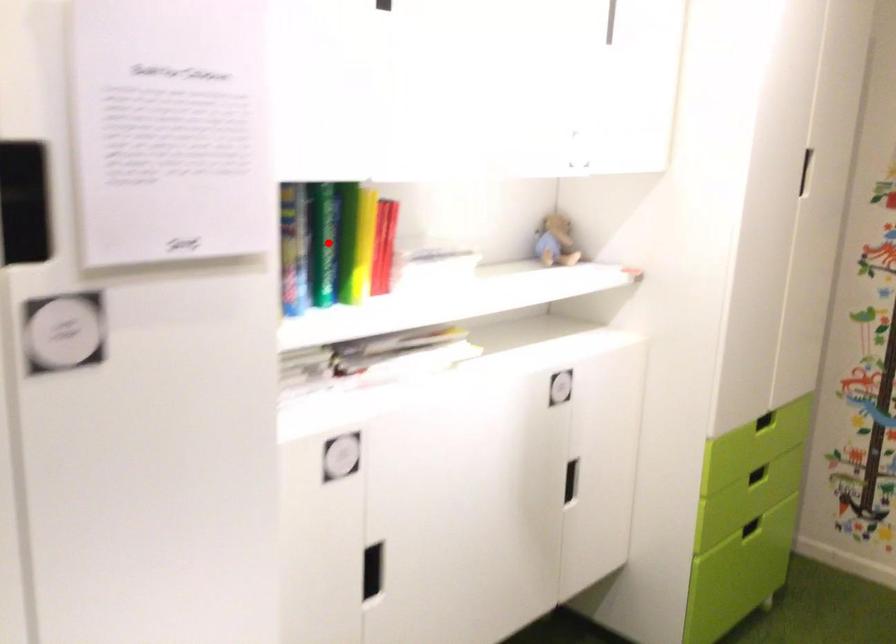
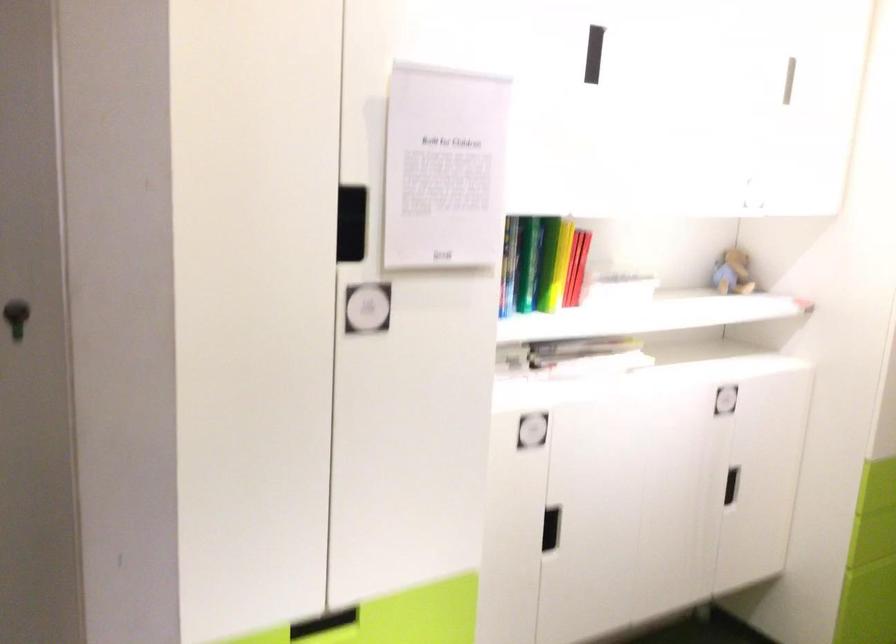
In the second image, find the point that corresponds to the highlighted location in the first image.

(528, 263)